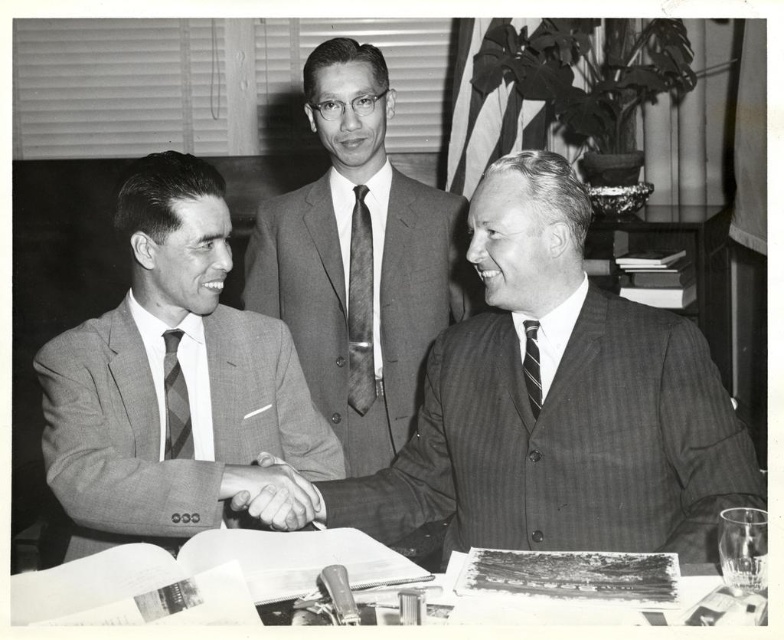
You are a photographer standing at the camera position. You want to take a closeup of the pinstriped suit at center. Can you reach it without moving your camera?

The pinstriped suit at center is 1.07 meters away from the camera, so yes, you can reach it without moving your camera for a closeup.